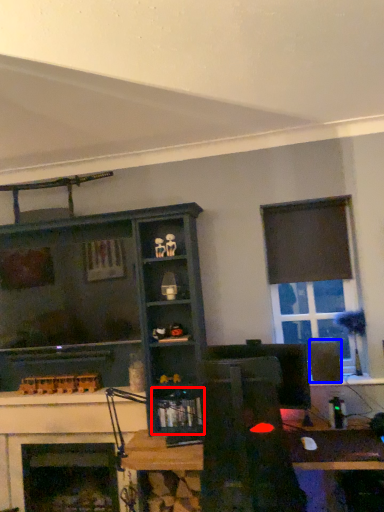
Question: Which object is closer to the camera taking this photo, shelf (highlighted by a red box) or speaker (highlighted by a blue box)?

Choices:
 (A) shelf
 (B) speaker

Answer: (B)